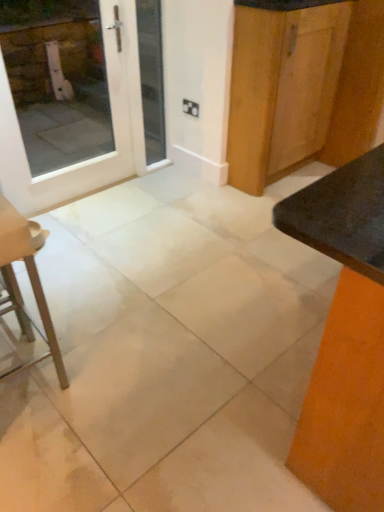
Measure the distance between point (163, 94) and camera.

The depth of point (163, 94) is 2.88 meters.

This screenshot has height=512, width=384. What do you see at coordinates (344, 337) in the screenshot? I see `matte black table at right` at bounding box center [344, 337].

What do you see at coordinates (30, 282) in the screenshot?
I see `metallic silver stool at lower left` at bounding box center [30, 282].

Find the location of a particular element. The image size is (384, 512). white glass door at upper left is located at coordinates (151, 78).

Who is bigger, wooden cabinet at upper right or matte black table at right?

matte black table at right.

From a real-world perspective, is wooden cabinet at upper right physically located above or below matte black table at right?

From a real-world perspective, wooden cabinet at upper right is physically above matte black table at right.

Can you confirm if wooden cabinet at upper right is wider than matte black table at right?

Incorrect, the width of wooden cabinet at upper right does not surpass that of matte black table at right.

From the image's perspective, is white glossy door at upper left above or below white tile floor at center?

From the image's perspective, white glossy door at upper left appears above white tile floor at center.

From the picture: Can you tell me how much white glossy door at upper left and white tile floor at center differ in facing direction?

There is a 90.6-degree angle between the facing directions of white glossy door at upper left and white tile floor at center.

Considering the relative positions of white glossy door at upper left and white tile floor at center in the image provided, is white glossy door at upper left to the left of white tile floor at center from the viewer's perspective?

Yes.

Would you consider white glossy door at upper left to be distant from white tile floor at center?

No, white glossy door at upper left is not far away from white tile floor at center.

From the image's perspective, which is above, white tile floor at center or white glass door at upper left?

white glass door at upper left.

Considering the sizes of white tile floor at center and white glass door at upper left in the image, is white tile floor at center taller or shorter than white glass door at upper left?

white tile floor at center is shorter than white glass door at upper left.

Would you say white tile floor at center is a long distance from white glass door at upper left?

That's right, there is a large distance between white tile floor at center and white glass door at upper left.

Can we say white tile floor at center lies outside white glass door at upper left?

Yes, white tile floor at center is not within white glass door at upper left.

Where is `cabinetry in front of the white glass door at upper left`? This screenshot has width=384, height=512. cabinetry in front of the white glass door at upper left is located at coordinates [282, 89].

Is white glass door at upper left beside wooden cabinet at upper right?

They are not placed beside each other.

Looking at this image, from a real-world perspective, which is physically above, white glass door at upper left or wooden cabinet at upper right?

wooden cabinet at upper right, from a real-world perspective.

Is white glass door at upper left wider than wooden cabinet at upper right?

Incorrect, the width of white glass door at upper left does not surpass that of wooden cabinet at upper right.

Is white tile floor at center oriented towards matte black table at right?

No, white tile floor at center does not turn towards matte black table at right.

From the image's perspective, between white tile floor at center and matte black table at right, which one is located above?

white tile floor at center is shown above in the image.

Does point (211, 454) come farther from viewer compared to point (378, 172)?

Yes.

Between white tile floor at center and matte black table at right, which one has smaller width?

Thinner between the two is matte black table at right.

From the image's perspective, which object appears higher, white tile floor at center or metallic silver stool at lower left?

white tile floor at center.

Could you tell me if white tile floor at center is facing metallic silver stool at lower left?

No, white tile floor at center is not turned towards metallic silver stool at lower left.

How far apart are white tile floor at center and metallic silver stool at lower left?

The distance of white tile floor at center from metallic silver stool at lower left is 22.71 inches.

Considering the relative sizes of white tile floor at center and metallic silver stool at lower left in the image provided, is white tile floor at center taller than metallic silver stool at lower left?

Incorrect, the height of white tile floor at center is not larger of that of metallic silver stool at lower left.

How far apart are metallic silver stool at lower left and white tile floor at center?

The distance of metallic silver stool at lower left from white tile floor at center is 57.68 centimeters.

Where is `furniture below the white tile floor at center (from the image's perspective)`? furniture below the white tile floor at center (from the image's perspective) is located at coordinates (30, 282).

Considering the sizes of objects metallic silver stool at lower left and white tile floor at center in the image provided, who is wider, metallic silver stool at lower left or white tile floor at center?

white tile floor at center is wider.

Where is `table on the right side of wooden cabinet at upper right`? table on the right side of wooden cabinet at upper right is located at coordinates (344, 337).

At what (x,y) coordinates should I click in order to perform the action: click on door above the white tile floor at center (from a real-world perspective). Please return your answer as a coordinate pair (x, y). The height and width of the screenshot is (512, 384). Looking at the image, I should click on (73, 165).

From the image, which object appears to be farther from white glossy door at upper left, metallic silver stool at lower left or wooden cabinet at upper right?

metallic silver stool at lower left is further to white glossy door at upper left.

Considering their positions, is white glass door at upper left positioned further to wooden cabinet at upper right than metallic silver stool at lower left?

The object further to wooden cabinet at upper right is metallic silver stool at lower left.

From the image, which object appears to be nearer to matte black table at right, white glossy door at upper left or metallic silver stool at lower left?

metallic silver stool at lower left.

Considering their positions, is wooden cabinet at upper right positioned closer to white glass door at upper left than matte black table at right?

wooden cabinet at upper right is positioned closer to the anchor white glass door at upper left.

When comparing their distances from wooden cabinet at upper right, does white glossy door at upper left or white tile floor at center seem further?

white glossy door at upper left is further to wooden cabinet at upper right.

Based on their spatial positions, is matte black table at right or white glossy door at upper left closer to metallic silver stool at lower left?

matte black table at right is positioned closer to the anchor metallic silver stool at lower left.

From the picture: When comparing their distances from white glossy door at upper left, does white glass door at upper left or matte black table at right seem closer?

white glass door at upper left is closer to white glossy door at upper left.

Looking at the image, which one is located closer to wooden cabinet at upper right, white tile floor at center or matte black table at right?

Among the two, white tile floor at center is located nearer to wooden cabinet at upper right.

At what (x,y) coordinates should I click in order to perform the action: click on furniture situated between white glossy door at upper left and wooden cabinet at upper right from left to right. Please return your answer as a coordinate pair (x, y). This screenshot has width=384, height=512. Looking at the image, I should click on (30, 282).

Where is `furniture between white tile floor at center and white glass door at upper left in the front-back direction`? The width and height of the screenshot is (384, 512). furniture between white tile floor at center and white glass door at upper left in the front-back direction is located at coordinates (30, 282).

You are a GUI agent. You are given a task and a screenshot of the screen. Output one action in this format:
    pyautogui.click(x=<x>, y=<y>)
    Task: Click on the furniture between white glossy door at upper left and matte black table at right in the horizontal direction
    This screenshot has height=512, width=384.
    Given the screenshot: What is the action you would take?
    pyautogui.click(x=30, y=282)

Identify the location of cabinetry between white glossy door at upper left and matte black table at right in the horizontal direction. The height and width of the screenshot is (512, 384). (282, 89).